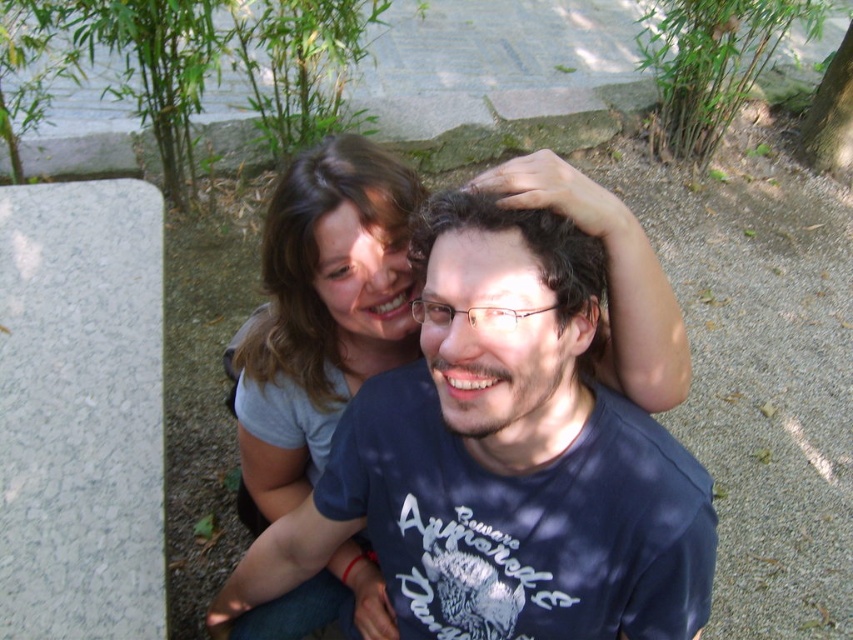
Which is in front, point (440, 291) or point (398, 209)?

Point (440, 291) is more forward.

Between blue cotton t-shirt at center and gray matte hair at upper center, which one has less height?

blue cotton t-shirt at center

Image resolution: width=853 pixels, height=640 pixels. In order to click on blue cotton t-shirt at center in this screenshot , I will do `click(503, 460)`.

The height and width of the screenshot is (640, 853). What are the coordinates of `blue cotton t-shirt at center` in the screenshot? It's located at (503, 460).